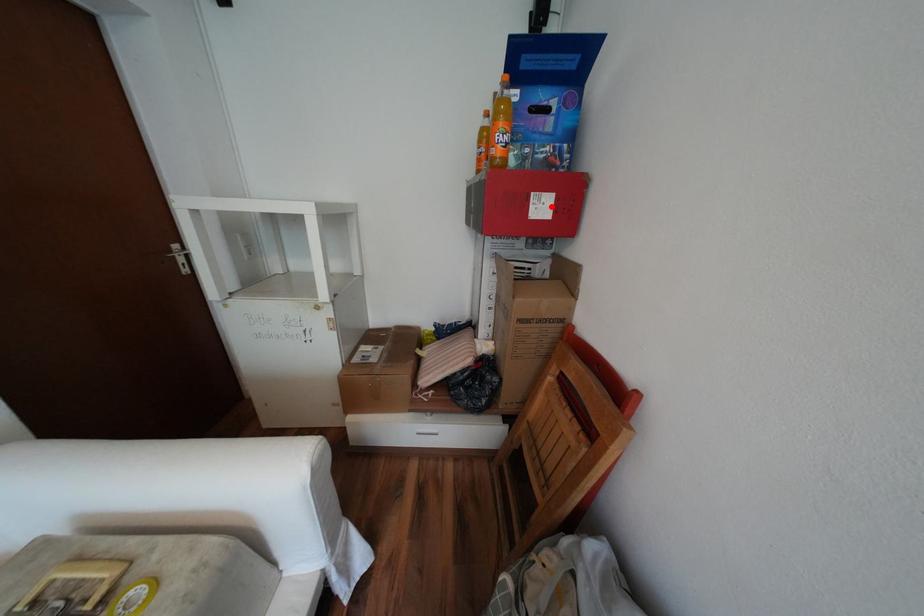
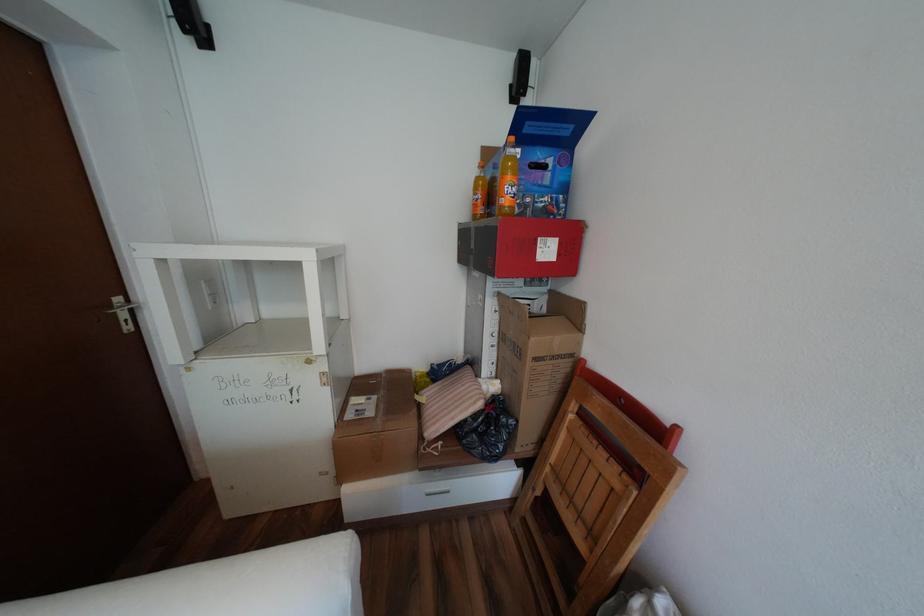
Where in the second image is the point corresponding to the highlighted location from the first image?

(556, 251)